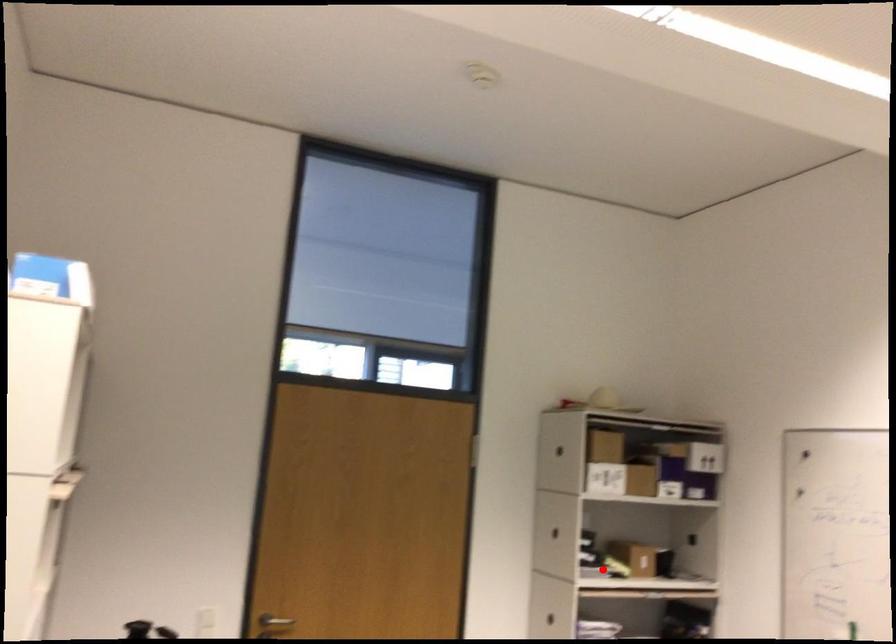
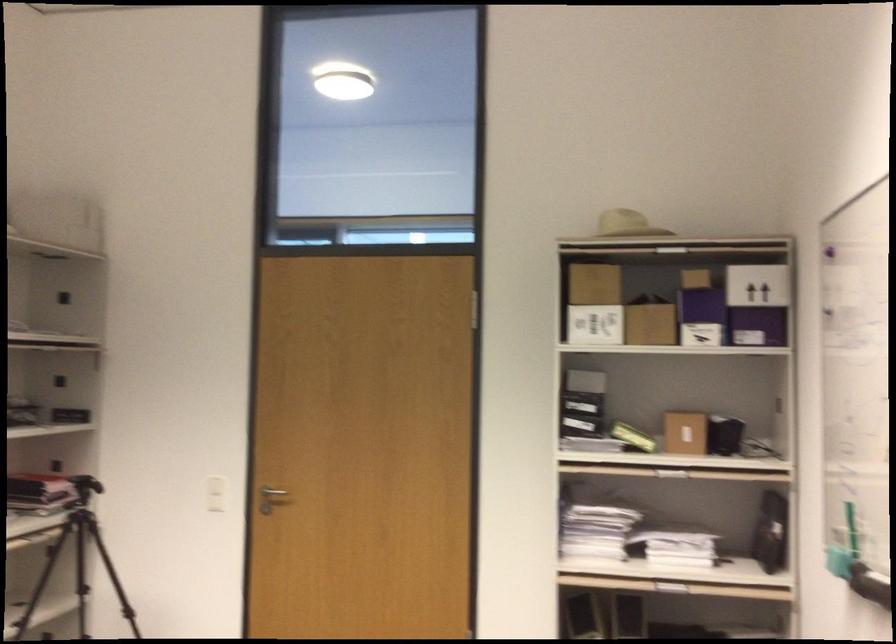
Question: A red point is marked in image1. In image2, is the corresponding 3D point closer to the camera or farther? Reply with the corresponding letter.

Choices:
 (A) The corresponding 3D point is closer.
 (B) The corresponding 3D point is farther.

Answer: (A)